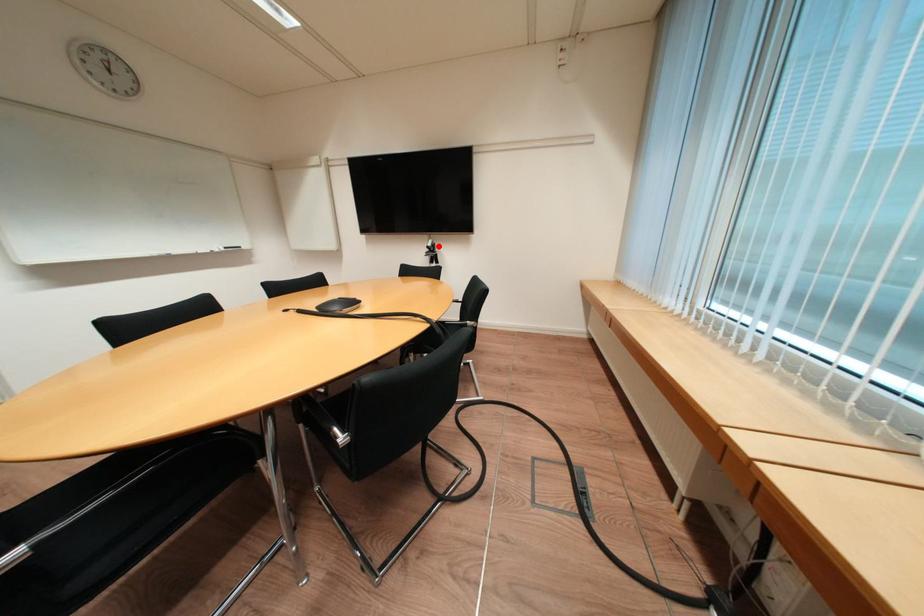
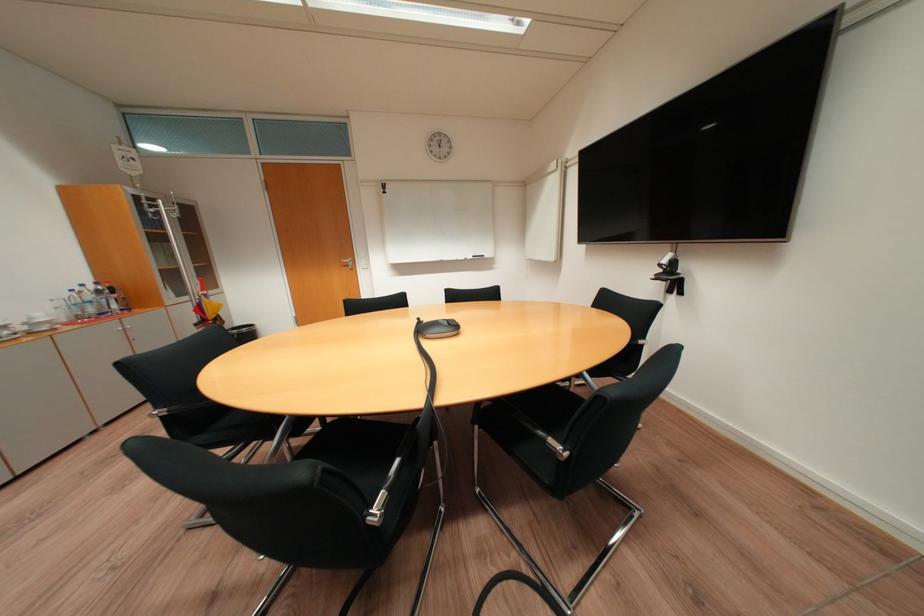
Question: I am providing you with two images of the same scene from different viewpoints. In image1, a red point is highlighted. Considering the same 3D point in image2, which of the following is correct?

Choices:
 (A) It is closer
 (B) It is farther

Answer: (B)